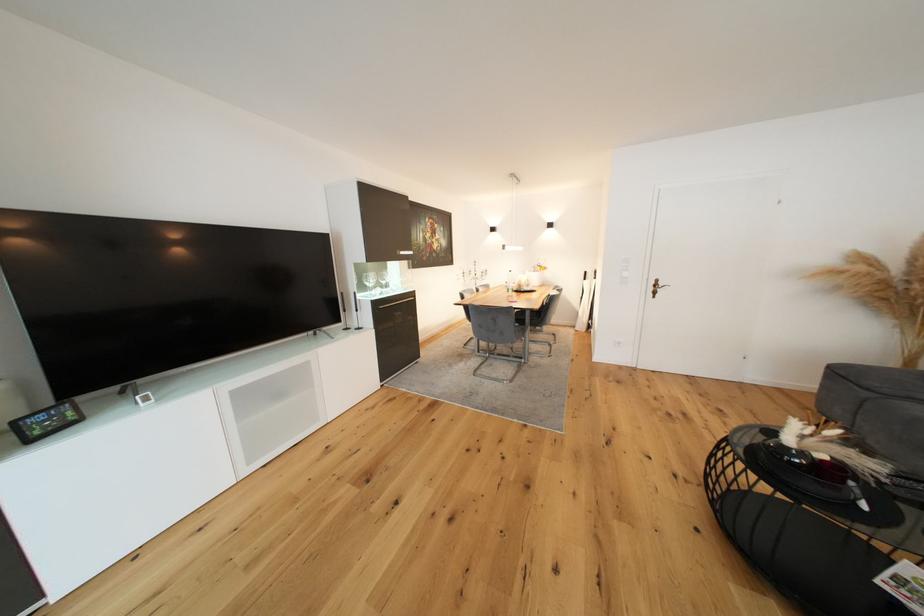
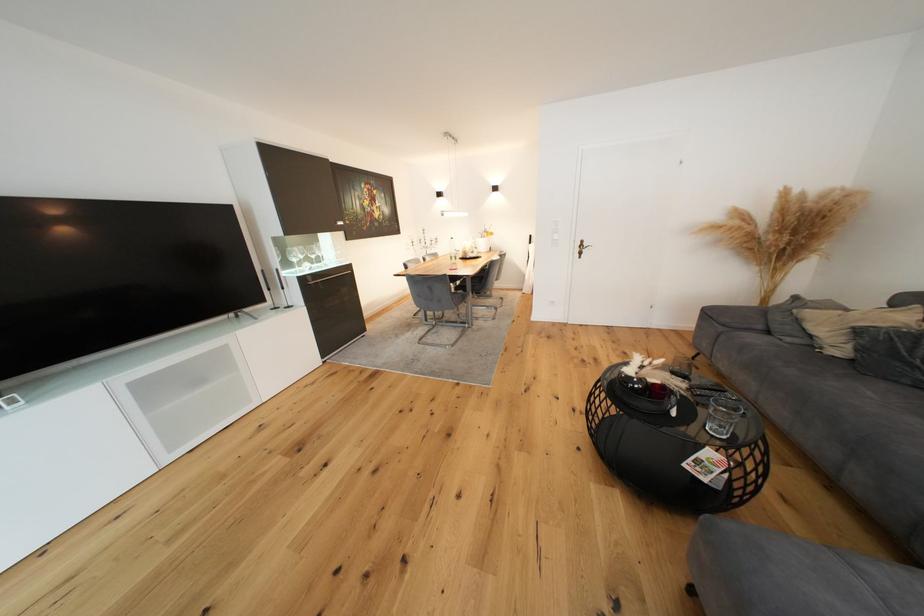
The point at (485, 276) is marked in the first image. Where is the corresponding point in the second image?

(435, 245)